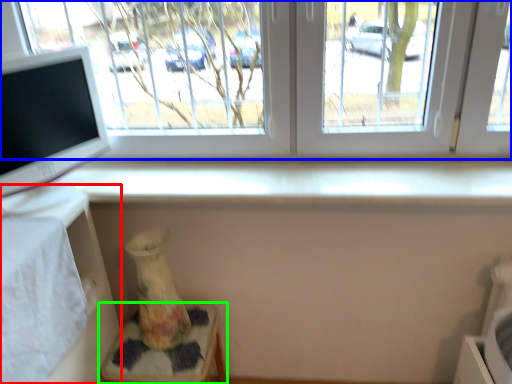
Question: Which is farther away from table (highlighted by a red box)? window (highlighted by a blue box) or furniture (highlighted by a green box)?

Choices:
 (A) window
 (B) furniture

Answer: (A)